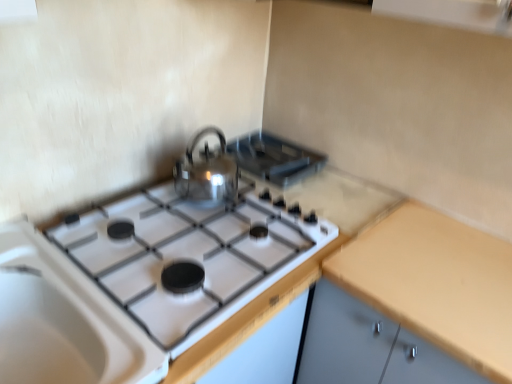
This screenshot has height=384, width=512. Describe the element at coordinates (435, 283) in the screenshot. I see `yellow matte countertop at right` at that location.

At what (x,y) coordinates should I click in order to perform the action: click on satin silver kettle at upper center. Please return your answer as a coordinate pair (x, y). This screenshot has width=512, height=384. Looking at the image, I should click on (275, 158).

In order to face satin silver kettle at upper center, should I rotate leftwards or rightwards?

Rotate your view right by about 2.169°.

Describe the element at coordinates (188, 257) in the screenshot. I see `white glossy gas stove at center` at that location.

The width and height of the screenshot is (512, 384). In order to click on yellow matte countertop at right in this screenshot , I will do `click(435, 283)`.

From a real-world perspective, is yellow matte countertop at right positioned under white glossy gas stove at center based on gravity?

Indeed, from a real-world perspective, yellow matte countertop at right is positioned beneath white glossy gas stove at center.

How different are the orientations of yellow matte countertop at right and white glossy gas stove at center in degrees?

There is a 91.1-degree angle between the facing directions of yellow matte countertop at right and white glossy gas stove at center.

Is yellow matte countertop at right smaller than white glossy gas stove at center?

Actually, yellow matte countertop at right might be larger than white glossy gas stove at center.

Identify the location of counter top in front of the white glossy gas stove at center. (435, 283).

Considering the relative positions of white glossy gas stove at center and shiny metallic kettle at center in the image provided, is white glossy gas stove at center to the right of shiny metallic kettle at center from the viewer's perspective?

No, white glossy gas stove at center is not to the right of shiny metallic kettle at center.

From the image's perspective, is white glossy gas stove at center on shiny metallic kettle at center?

No, from the image's perspective, white glossy gas stove at center is not above shiny metallic kettle at center.

Find the location of `gas stove in front of the shiny metallic kettle at center`. gas stove in front of the shiny metallic kettle at center is located at coordinates (188, 257).

Between point (178, 251) and point (218, 184), which one is positioned in front?

Point (178, 251)

From a real-world perspective, between yellow matte countertop at right and shiny metallic kettle at center, who is vertically lower?

From a 3D spatial view, yellow matte countertop at right is below.

From the image's perspective, which is below, yellow matte countertop at right or shiny metallic kettle at center?

From the image's view, yellow matte countertop at right is below.

Is yellow matte countertop at right not close to shiny metallic kettle at center?

No, yellow matte countertop at right is in close proximity to shiny metallic kettle at center.

Identify the location of counter top below the shiny metallic kettle at center (from the image's perspective). The width and height of the screenshot is (512, 384). (435, 283).

From the image's perspective, is satin silver kettle at upper center located above or below shiny metallic kettle at center?

From the image's perspective, satin silver kettle at upper center appears above shiny metallic kettle at center.

This screenshot has width=512, height=384. In order to click on kitchen appliance below the satin silver kettle at upper center (from the image's perspective) in this screenshot , I will do `click(207, 173)`.

Would you say satin silver kettle at upper center contains shiny metallic kettle at center?

No, shiny metallic kettle at center is not surrounded by satin silver kettle at upper center.

Considering the sizes of objects satin silver kettle at upper center and shiny metallic kettle at center in the image provided, who is wider, satin silver kettle at upper center or shiny metallic kettle at center?

Wider between the two is satin silver kettle at upper center.

Does point (323, 161) come behind point (495, 370)?

Yes, point (323, 161) is behind point (495, 370).

Is satin silver kettle at upper center not inside yellow matte countertop at right?

Indeed, satin silver kettle at upper center is completely outside yellow matte countertop at right.

Which object is further away from the camera taking this photo, satin silver kettle at upper center or yellow matte countertop at right?

satin silver kettle at upper center is further away from the camera.

Are shiny metallic kettle at center and white glossy gas stove at center located far from each other?

Actually, shiny metallic kettle at center and white glossy gas stove at center are a little close together.

Considering the sizes of shiny metallic kettle at center and white glossy gas stove at center in the image, is shiny metallic kettle at center wider or thinner than white glossy gas stove at center?

Clearly, shiny metallic kettle at center has less width compared to white glossy gas stove at center.

Measure the distance from shiny metallic kettle at center to white glossy gas stove at center.

shiny metallic kettle at center and white glossy gas stove at center are 8.12 inches apart.

In the scene shown: From the image's perspective, which one is positioned higher, shiny metallic kettle at center or white glossy gas stove at center?

shiny metallic kettle at center is shown above in the image.

Does satin silver kettle at upper center have a larger size compared to white glossy gas stove at center?

Actually, satin silver kettle at upper center might be smaller than white glossy gas stove at center.

At what (x,y) coordinates should I click in order to perform the action: click on appliance that appears on the right of white glossy gas stove at center. Please return your answer as a coordinate pair (x, y). The image size is (512, 384). Looking at the image, I should click on (275, 158).

Looking at this image, is satin silver kettle at upper center oriented towards white glossy gas stove at center?

Yes, satin silver kettle at upper center is facing white glossy gas stove at center.

Based on the photo, from the image's perspective, relative to white glossy gas stove at center, is satin silver kettle at upper center above or below?

Based on their image positions, satin silver kettle at upper center is located above white glossy gas stove at center.

Locate an element on the screen. counter top in front of the white glossy gas stove at center is located at coordinates (435, 283).

You are a GUI agent. You are given a task and a screenshot of the screen. Output one action in this format:
    pyautogui.click(x=<x>, y=<y>)
    Task: Click on the kitchen appliance above the white glossy gas stove at center (from a real-world perspective)
    
    Given the screenshot: What is the action you would take?
    pyautogui.click(x=207, y=173)

From the image, which object appears to be nearer to white glossy gas stove at center, yellow matte countertop at right or shiny metallic kettle at center?

shiny metallic kettle at center.

From the image, which object appears to be farther from shiny metallic kettle at center, white glossy gas stove at center or satin silver kettle at upper center?

white glossy gas stove at center lies further to shiny metallic kettle at center than the other object.

From the image, which object appears to be farther from white glossy gas stove at center, shiny metallic kettle at center or satin silver kettle at upper center?

Based on the image, satin silver kettle at upper center appears to be further to white glossy gas stove at center.

When comparing their distances from white glossy gas stove at center, does satin silver kettle at upper center or yellow matte countertop at right seem closer?

The object closer to white glossy gas stove at center is yellow matte countertop at right.

Which object lies nearer to the anchor point yellow matte countertop at right, white glossy gas stove at center or shiny metallic kettle at center?

Among the two, white glossy gas stove at center is located nearer to yellow matte countertop at right.

Based on their spatial positions, is white glossy gas stove at center or shiny metallic kettle at center closer to satin silver kettle at upper center?

Based on the image, shiny metallic kettle at center appears to be nearer to satin silver kettle at upper center.

Estimate the real-world distances between objects in this image. Which object is further from yellow matte countertop at right, satin silver kettle at upper center or shiny metallic kettle at center?

shiny metallic kettle at center is positioned further to the anchor yellow matte countertop at right.

Looking at the image, which one is located further to satin silver kettle at upper center, white glossy gas stove at center or yellow matte countertop at right?

yellow matte countertop at right is further to satin silver kettle at upper center.

At what (x,y) coordinates should I click in order to perform the action: click on kitchen appliance between satin silver kettle at upper center and yellow matte countertop at right vertically. Please return your answer as a coordinate pair (x, y). Looking at the image, I should click on (207, 173).

I want to click on appliance between white glossy gas stove at center and yellow matte countertop at right from left to right, so click(275, 158).

The height and width of the screenshot is (384, 512). I want to click on kitchen appliance between white glossy gas stove at center and satin silver kettle at upper center in the front-back direction, so click(207, 173).

Image resolution: width=512 pixels, height=384 pixels. What are the coordinates of `kitchen appliance between white glossy gas stove at center and yellow matte countertop at right in the horizontal direction` in the screenshot? It's located at (207, 173).